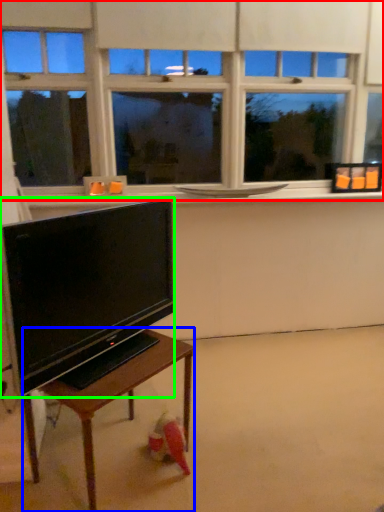
Question: Which is nearer to the window (highlighted by a red box)? table (highlighted by a blue box) or television (highlighted by a green box).

Choices:
 (A) table
 (B) television

Answer: (B)